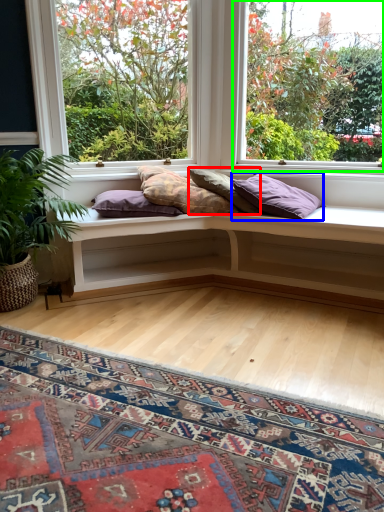
Question: Which object is positioned farthest from pillow (highlighted by a red box)? Select from pillow (highlighted by a blue box) and window (highlighted by a green box).

Choices:
 (A) pillow
 (B) window

Answer: (B)